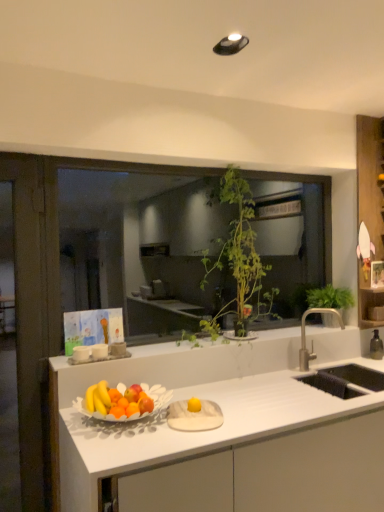
Question: Would you say white matte countertop at center is to the left or to the right of wooden shelf at right in the picture?

Choices:
 (A) left
 (B) right

Answer: (A)

Question: Is white matte countertop at center taller or shorter than wooden shelf at right?

Choices:
 (A) tall
 (B) short

Answer: (B)

Question: Estimate the real-world distances between objects in this image. Which object is closer to the white matte countertop at center?

Choices:
 (A) green leafy plant at center
 (B) green leafy plant at upper right, which appears as the 1th houseplant when viewed from the right
 (C) silver metallic faucet at right
 (D) wooden shelf at right
 (E) matte white bowl of fruits at center

Answer: (E)

Question: Estimate the real-world distances between objects in this image. Which object is farther from the green leafy plant at upper right, which appears as the 1th houseplant when viewed from the right?

Choices:
 (A) green leafy plant at center
 (B) wooden shelf at right
 (C) white matte countertop at center
 (D) matte white bowl of fruits at center
 (E) silver metallic faucet at right

Answer: (A)